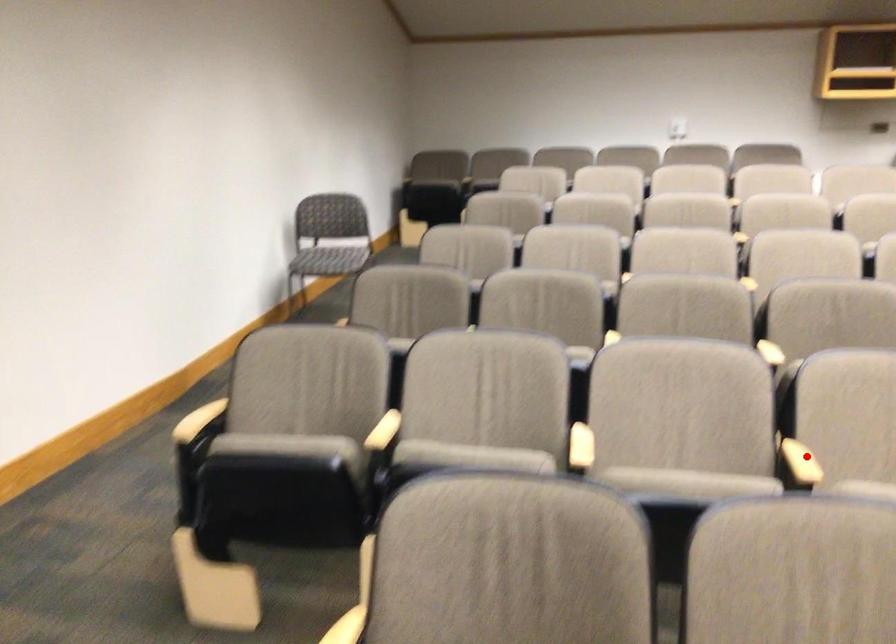
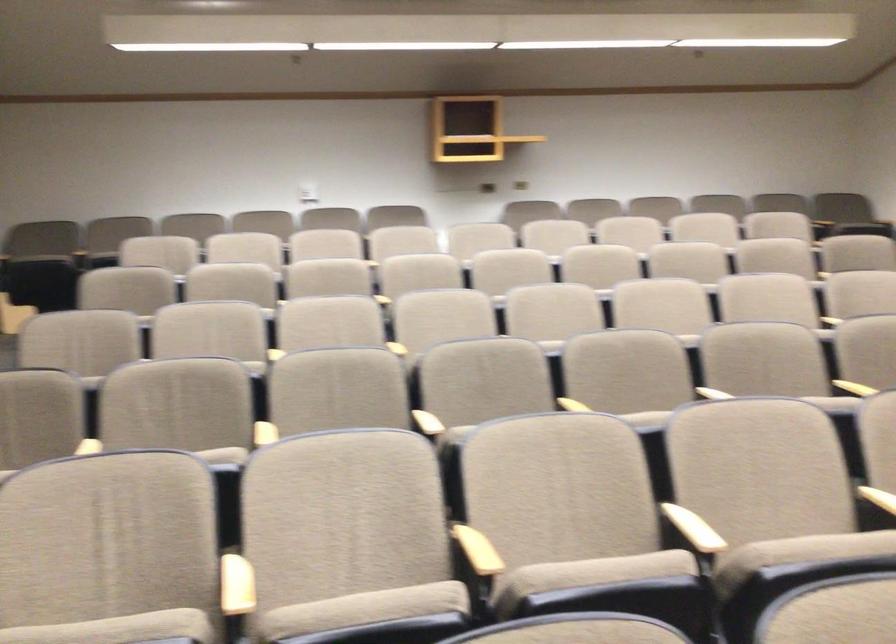
The point at the highlighted location is marked in the first image. Where is the corresponding point in the second image?

(478, 550)